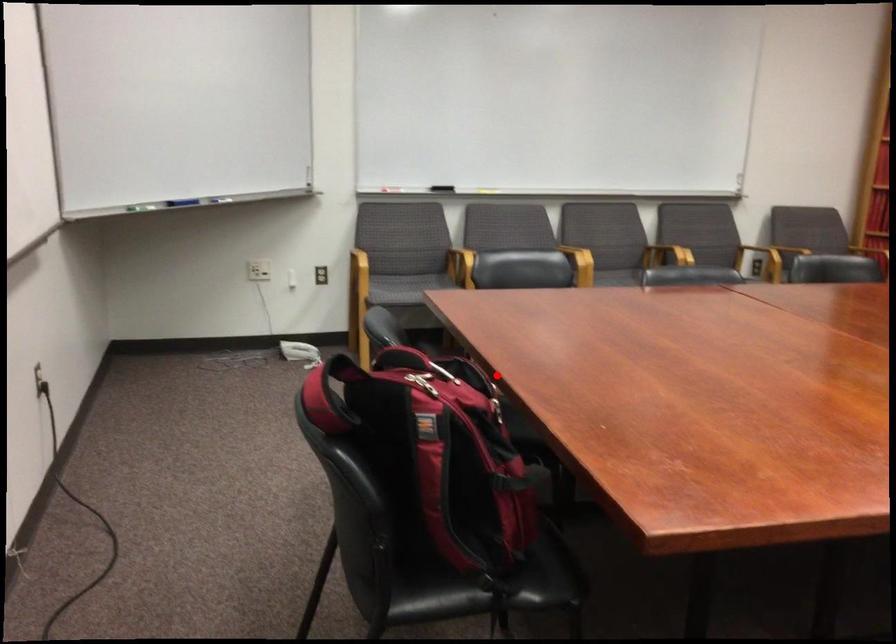
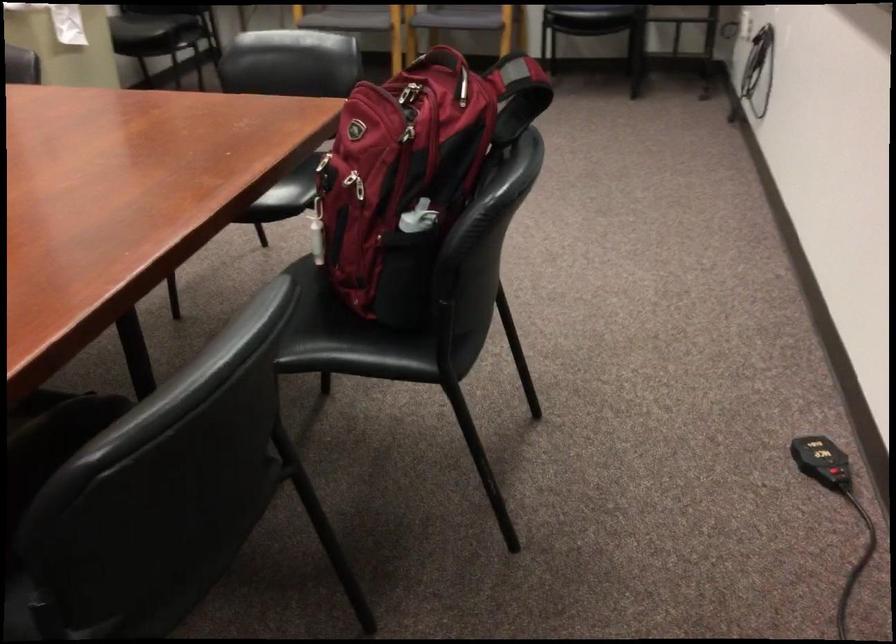
Question: I am providing you with two images of the same scene from different viewpoints. Image1 has a red point marked. In image2, the corresponding 3D location appears at what relative position? Reply with the corresponding letter.

Choices:
 (A) Closer
 (B) Farther

Answer: (A)